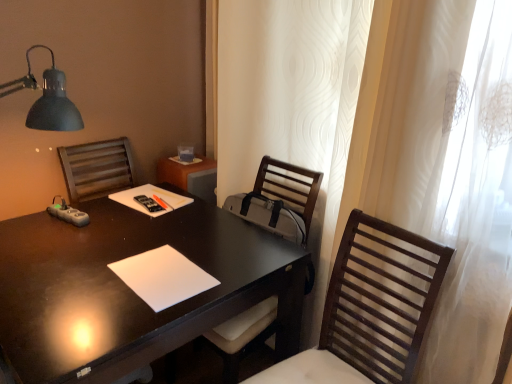
Locate an element on the screen. This screenshot has width=512, height=384. vacant area located to the right-hand side of black plastic remote control at center is located at coordinates (187, 208).